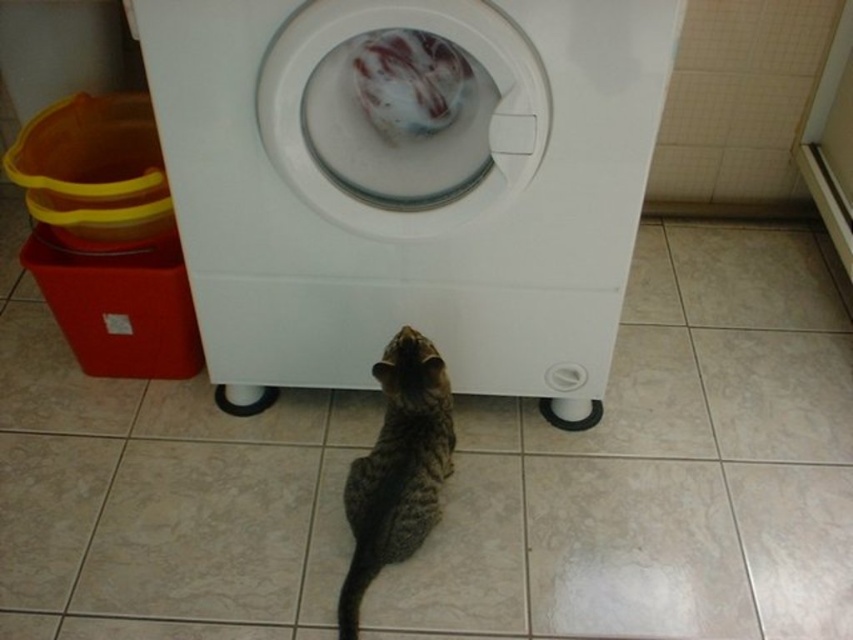
Question: Does white plastic washing machine at center appear over tabby fur cat at center?

Choices:
 (A) no
 (B) yes

Answer: (B)

Question: Does white plastic washing machine at center appear on the right side of tabby fur cat at center?

Choices:
 (A) yes
 (B) no

Answer: (A)

Question: Among these points, which one is nearest to the camera?

Choices:
 (A) (546, 364)
 (B) (364, 536)

Answer: (B)

Question: Does white plastic washing machine at center have a smaller size compared to tabby fur cat at center?

Choices:
 (A) no
 (B) yes

Answer: (A)

Question: Which point is farther to the camera?

Choices:
 (A) (310, 122)
 (B) (407, 444)

Answer: (B)